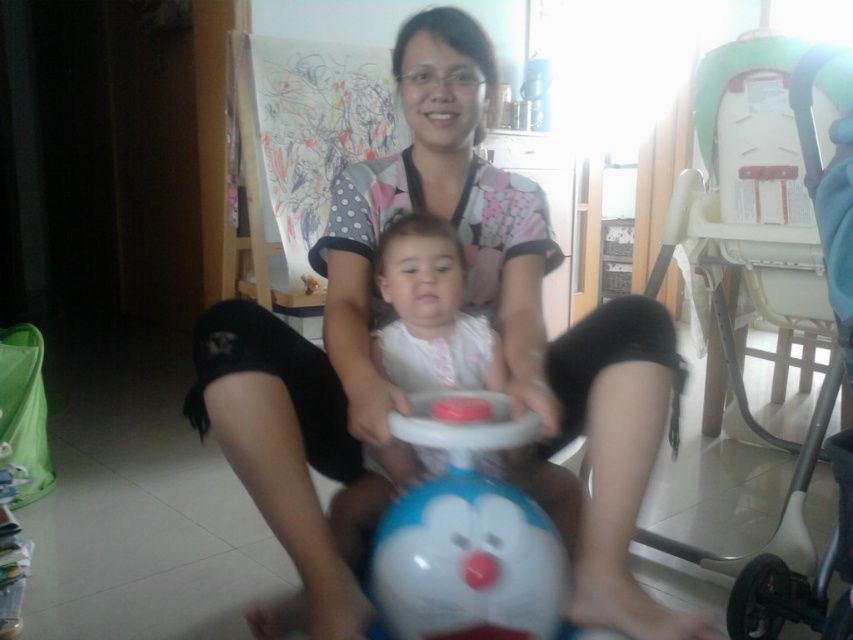
Please look at the image. There is a point at coordinate (766, 280). Which object in the scene does this point belong to?

The point at coordinate (766, 280) belongs to the white plastic baby carriage at upper right.